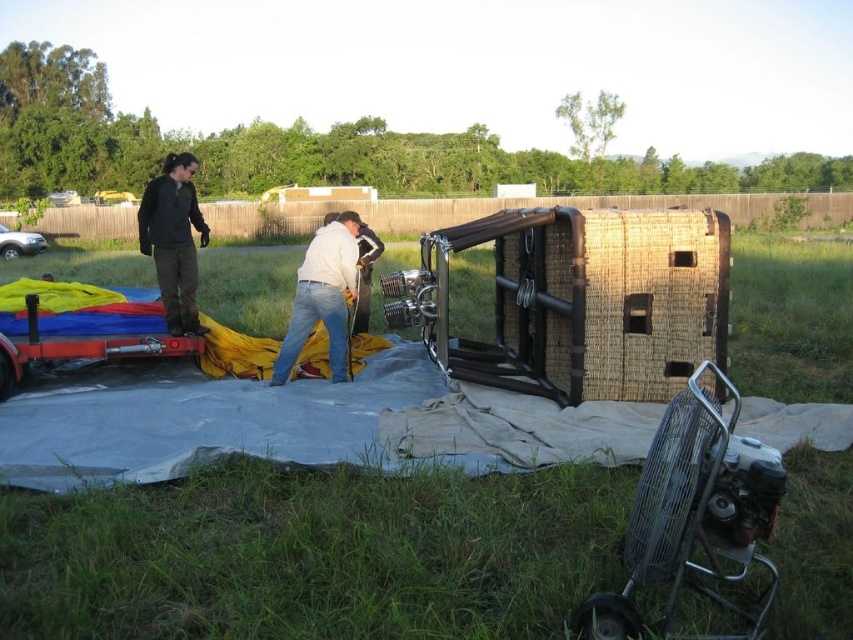
Question: Which point appears closest to the camera in this image?

Choices:
 (A) (62, 192)
 (B) (25, 237)
 (C) (306, 332)
 (D) (670, 476)

Answer: (D)

Question: Does metallic silver fan at lower right appear on the left side of dark gray jacket at left?

Choices:
 (A) no
 (B) yes

Answer: (A)

Question: Which point appears farthest from the camera in this image?

Choices:
 (A) 347,291
 (B) 62,193
 (C) 779,493
 (D) 175,173

Answer: (B)

Question: Is metallic silver fan at lower right to the left of metallic silver car at upper left from the viewer's perspective?

Choices:
 (A) no
 (B) yes

Answer: (A)

Question: Can you confirm if dark gray jacket at left is smaller than white cotton shirt at center?

Choices:
 (A) no
 (B) yes

Answer: (A)

Question: Which object is positioned closest to the dark gray jacket at left?

Choices:
 (A) white cotton shirt at center
 (B) metallic silver fan at lower right
 (C) silver metallic car at left

Answer: (A)